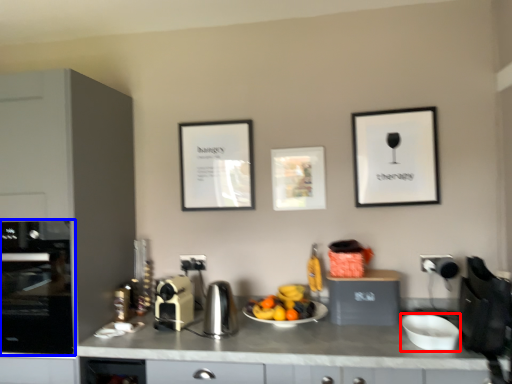
Question: Which object is closer to the camera taking this photo, bowl (highlighted by a red box) or home appliance (highlighted by a blue box)?

Choices:
 (A) bowl
 (B) home appliance

Answer: (A)